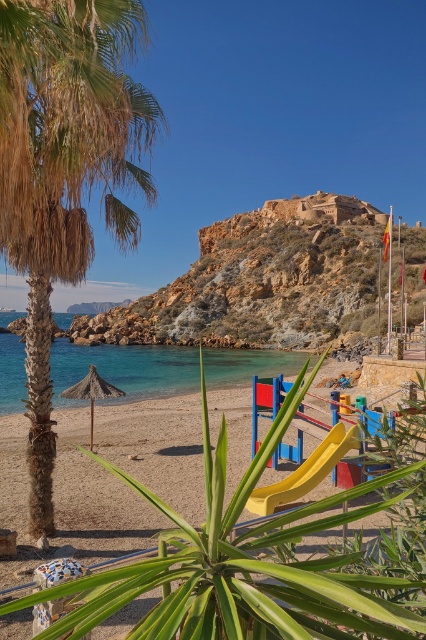
Question: Which object is positioned farthest from the clear blue water at center?

Choices:
 (A) natural straw umbrella at center
 (B) yellow plastic slide at center

Answer: (A)

Question: Does fine-grained sand at center have a smaller size compared to clear blue water at center?

Choices:
 (A) no
 (B) yes

Answer: (B)

Question: Among these points, which one is nearest to the camera?

Choices:
 (A) (42, 172)
 (B) (282, 515)
 (C) (294, 364)
 (D) (331, 433)

Answer: (B)

Question: Can you confirm if fine-grained sand at center is wider than yellow plastic slide at center?

Choices:
 (A) yes
 (B) no

Answer: (A)

Question: Which object appears farthest from the camera in this image?

Choices:
 (A) natural straw umbrella at center
 (B) yellow plastic slide at center
 (C) fine-grained sand at center

Answer: (A)

Question: Can you confirm if fine-grained sand at center is positioned above yellow plastic slide at center?

Choices:
 (A) no
 (B) yes

Answer: (B)